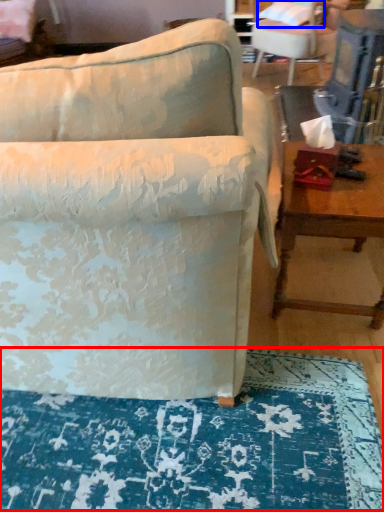
Question: Which object is closer to the camera taking this photo, mat (highlighted by a red box) or pillow (highlighted by a blue box)?

Choices:
 (A) mat
 (B) pillow

Answer: (A)